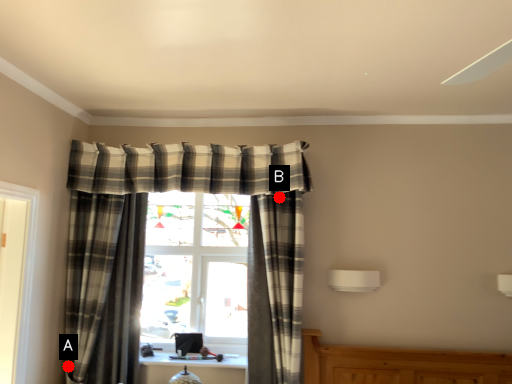
Question: Two points are circled on the image, labeled by A and B beside each circle. Which point is farther to the camera?

Choices:
 (A) A is further
 (B) B is further

Answer: (A)